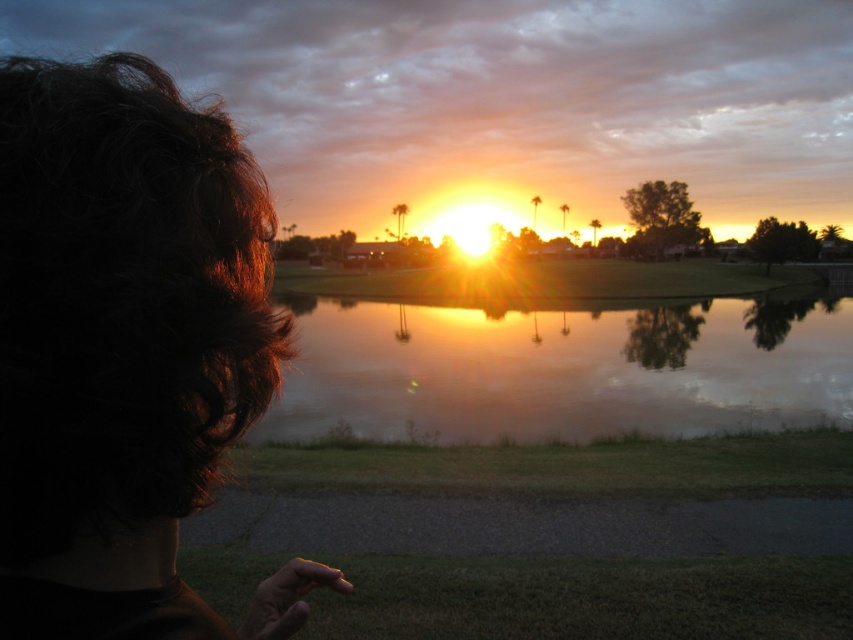
You are a photographer trying to capture the sunset reflection on the water. You notice the dark brown hair at left and the glistening reflective water at center. Which object is located to the left of the other?

The dark brown hair at left is positioned on the left side of glistening reflective water at center.

You are standing in the grassy area near the water and see two points in the scene. The first point is at coordinates point (167,348) and the second is at point (520,276). Which point is closer to you?

Point (167,348) is in front of point (520,276), so it is closer to you.